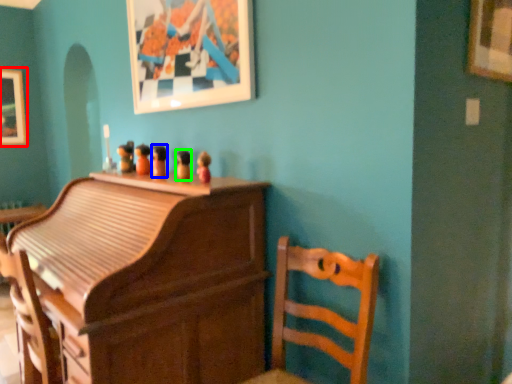
Question: Which is nearer to the picture frame (highlighted by a red box)? toy (highlighted by a blue box) or toy (highlighted by a green box).

Choices:
 (A) toy
 (B) toy

Answer: (A)